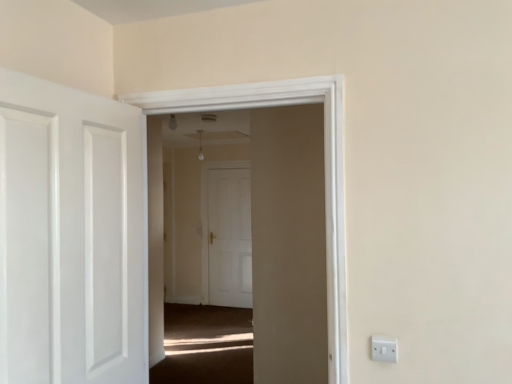
Question: Does white matte door at center, the 2th door viewed from the front, have a lesser width compared to transparent glass door at center?

Choices:
 (A) no
 (B) yes

Answer: (B)

Question: Does white matte door at center, the 2th door viewed from the front, have a larger size compared to transparent glass door at center?

Choices:
 (A) yes
 (B) no

Answer: (B)

Question: Is white matte door at center, the 2th door viewed from the front, outside of transparent glass door at center?

Choices:
 (A) no
 (B) yes

Answer: (B)

Question: From the image's perspective, is white matte door at center, the 1th door viewed from the back, beneath transparent glass door at center?

Choices:
 (A) yes
 (B) no

Answer: (A)

Question: Is white matte door at center, the 1th door viewed from the back, not near transparent glass door at center?

Choices:
 (A) no
 (B) yes

Answer: (B)

Question: Is white matte door at center, the 1th door viewed from the back, to the right of transparent glass door at center from the viewer's perspective?

Choices:
 (A) yes
 (B) no

Answer: (B)

Question: Is white glossy door at left, which is the 1th door from front to back, closer to the viewer compared to white plastic switch at lower right?

Choices:
 (A) yes
 (B) no

Answer: (A)

Question: From a real-world perspective, is white glossy door at left, the 2th door from the back, physically below white plastic switch at lower right?

Choices:
 (A) no
 (B) yes

Answer: (A)

Question: Considering the relative sizes of white glossy door at left, which is the 1th door from front to back, and white plastic switch at lower right in the image provided, is white glossy door at left, which is the 1th door from front to back, taller than white plastic switch at lower right?

Choices:
 (A) yes
 (B) no

Answer: (A)

Question: Is white glossy door at left, the 2th door from the back, oriented towards white plastic switch at lower right?

Choices:
 (A) yes
 (B) no

Answer: (A)

Question: Considering the relative sizes of white glossy door at left, the 2th door from the back, and white plastic switch at lower right in the image provided, is white glossy door at left, the 2th door from the back, wider than white plastic switch at lower right?

Choices:
 (A) no
 (B) yes

Answer: (B)

Question: Is white glossy door at left, the 2th door from the back, directly adjacent to white plastic switch at lower right?

Choices:
 (A) no
 (B) yes

Answer: (A)

Question: Would you say white matte door at center, the 1th door viewed from the back, is part of white plastic switch at lower right's contents?

Choices:
 (A) yes
 (B) no

Answer: (B)